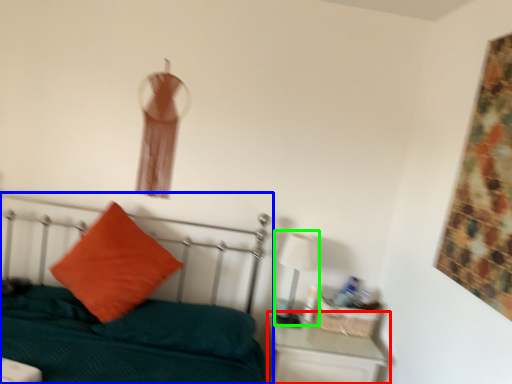
Question: Based on their relative distances, which object is farther from nightstand (highlighted by a red box)? Choose from bed (highlighted by a blue box) and table lamp (highlighted by a green box).

Choices:
 (A) bed
 (B) table lamp

Answer: (A)